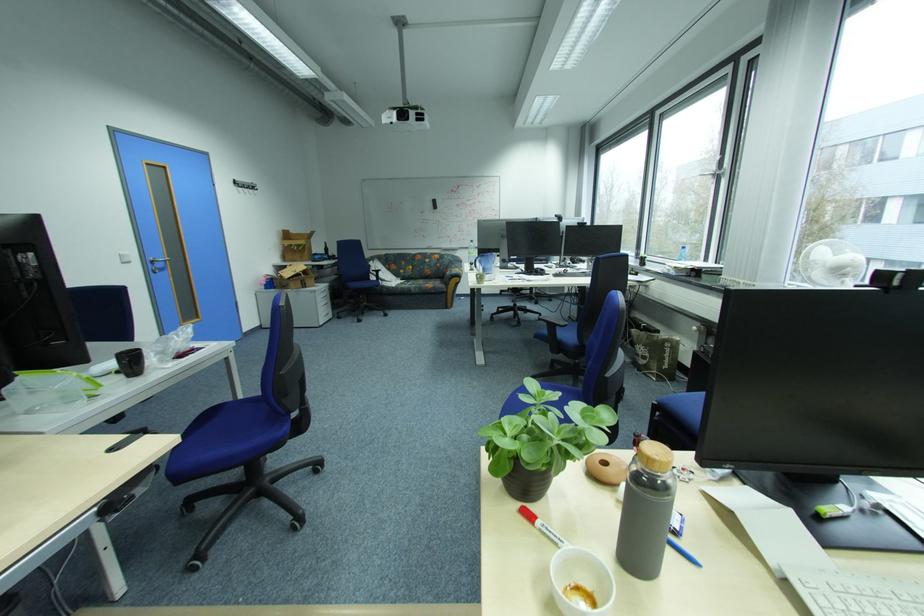
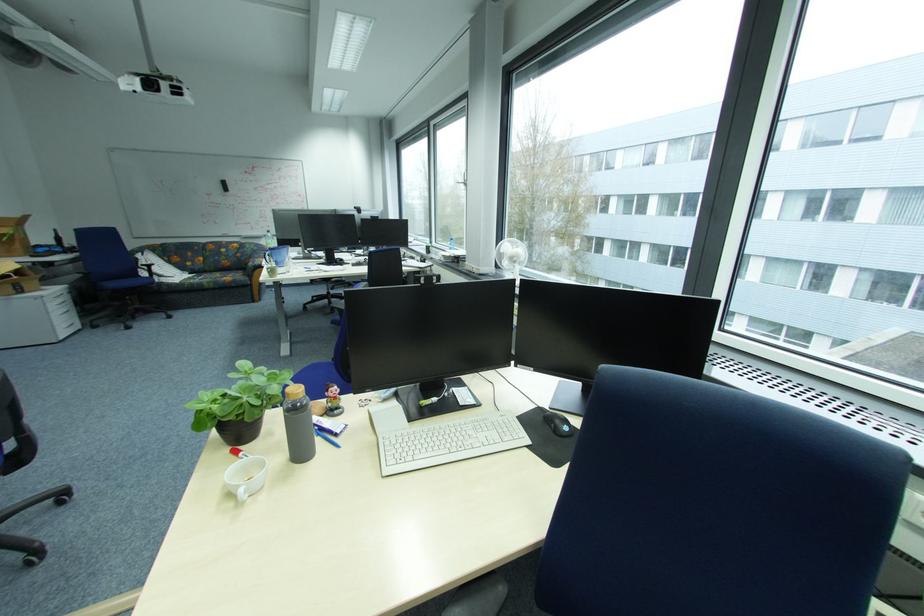
Where in the second image is the point corresponding to point (421, 291) from the first image?

(214, 286)